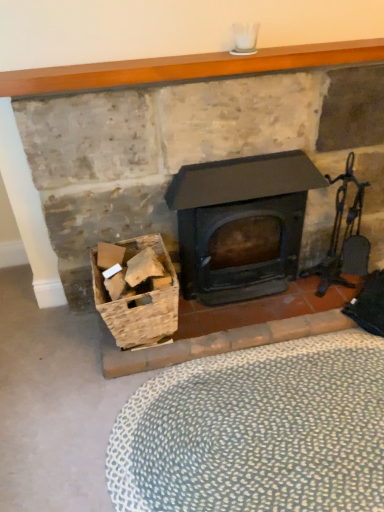
The image size is (384, 512). I want to click on blank area beneath matte black wood burning stove at center (from a real-world perspective), so click(x=245, y=298).